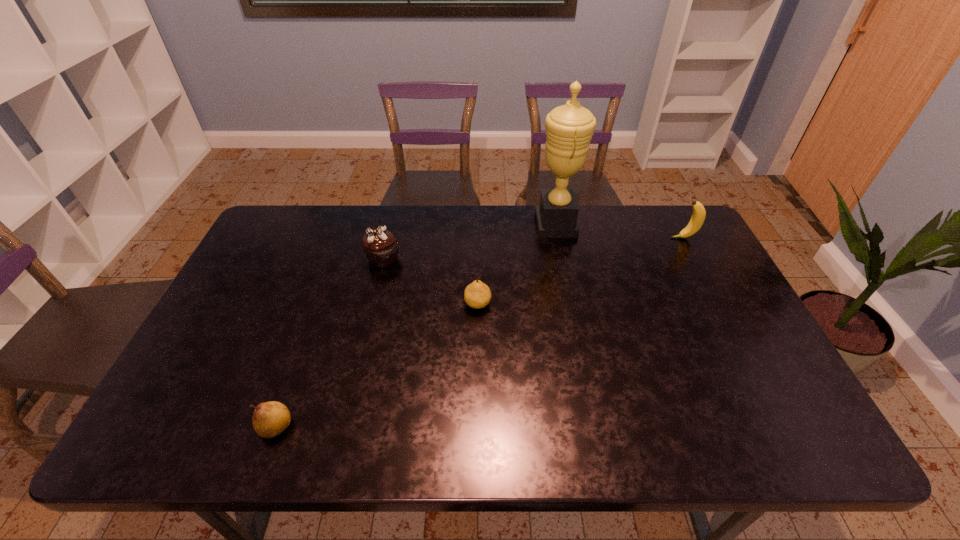
Where is `vacant space located at the front of the trophy cup with handles`? The image size is (960, 540). vacant space located at the front of the trophy cup with handles is located at coordinates (476, 225).

The height and width of the screenshot is (540, 960). I want to click on free point located 0.330m at the front of the trophy cup with handles, so click(x=439, y=225).

You are a GUI agent. You are given a task and a screenshot of the screen. Output one action in this format:
    pyautogui.click(x=<x>, y=<y>)
    Task: Click on the free spot located at the front of the trophy cup with handles
    Image resolution: width=960 pixels, height=540 pixels.
    Given the screenshot: What is the action you would take?
    pyautogui.click(x=456, y=225)

Where is `free space located 0.320m from the stem of the banana`? This screenshot has height=540, width=960. free space located 0.320m from the stem of the banana is located at coordinates (574, 238).

The height and width of the screenshot is (540, 960). In order to click on free space located from the stem of the banana in this screenshot , I will do `click(653, 238)`.

You are a GUI agent. You are given a task and a screenshot of the screen. Output one action in this format:
    pyautogui.click(x=<x>, y=<y>)
    Task: Click on the vacant space located from the stem of the banana
    The image size is (960, 540).
    Given the screenshot: What is the action you would take?
    pyautogui.click(x=563, y=238)

Identify the location of vacant space located on the front of the cupcake. The image size is (960, 540). (363, 343).

Locate an element on the screen. free space located 0.170m on the back of the right pear is located at coordinates [x=478, y=255].

Image resolution: width=960 pixels, height=540 pixels. I want to click on vacant region located 0.180m on the back of the leftmost object, so click(x=304, y=348).

The width and height of the screenshot is (960, 540). In order to click on trophy cup at the far edge in this screenshot , I will do `click(569, 128)`.